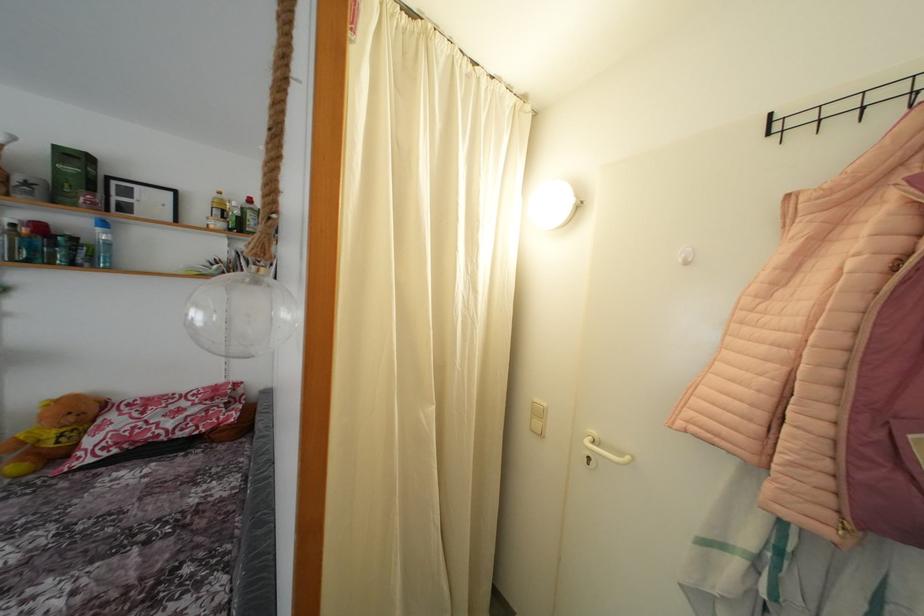
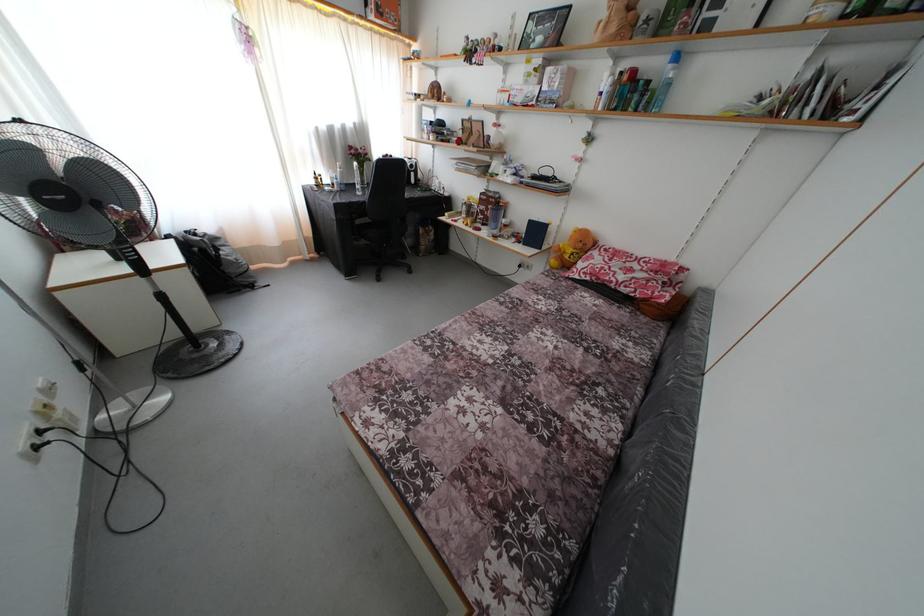
In the second image, find the point that corresponds to [251,469] in the first image.

(663, 353)